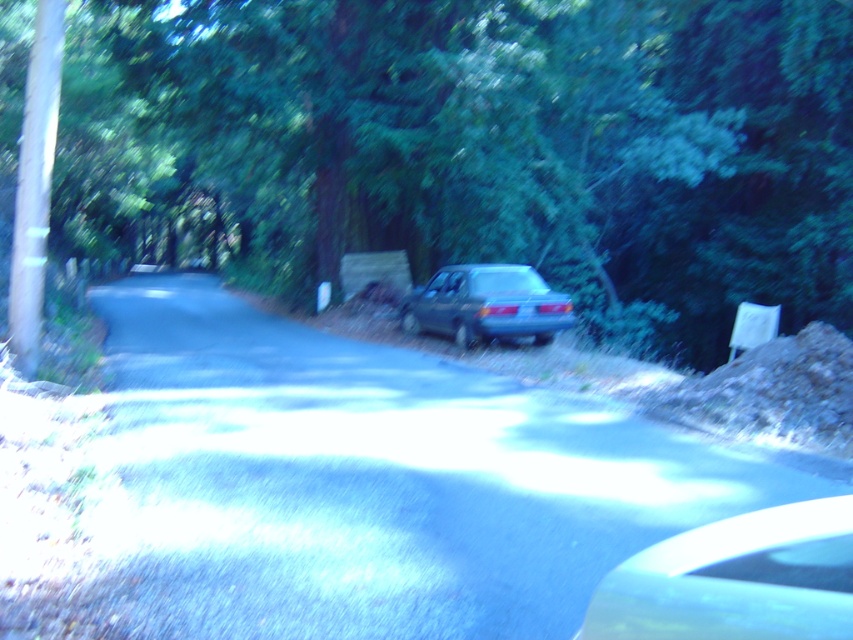
Based on the photo, you are driving a car and need to pass through the road shown in the image. There is a green leafy tree at center and a glossy metallic car at center. Which object is closer to your current position as you drive along the road?

The green leafy tree at center is closer to your current position because it is further to the viewer than the glossy metallic car at center, meaning it appears nearer in the visual perspective.

You are driving a truck that is 20 feet long and need to pass through the space between the glossy metallic car at center and the satin blue sedan at center. Can your truck fit through the space between them?

The glossy metallic car at center is 46.74 feet from the satin blue sedan at center. Since your truck is 20 feet long, the distance between the two vehicles is more than sufficient for your truck to pass through comfortably.

You are driving a car and want to take a photo of two points on the road ahead. The points are labeled as point (705, 573) and point (451, 321). Based on the scene, which point will appear closer to the camera in the photo?

Point (705, 573) is closer to the camera than point (451, 321).